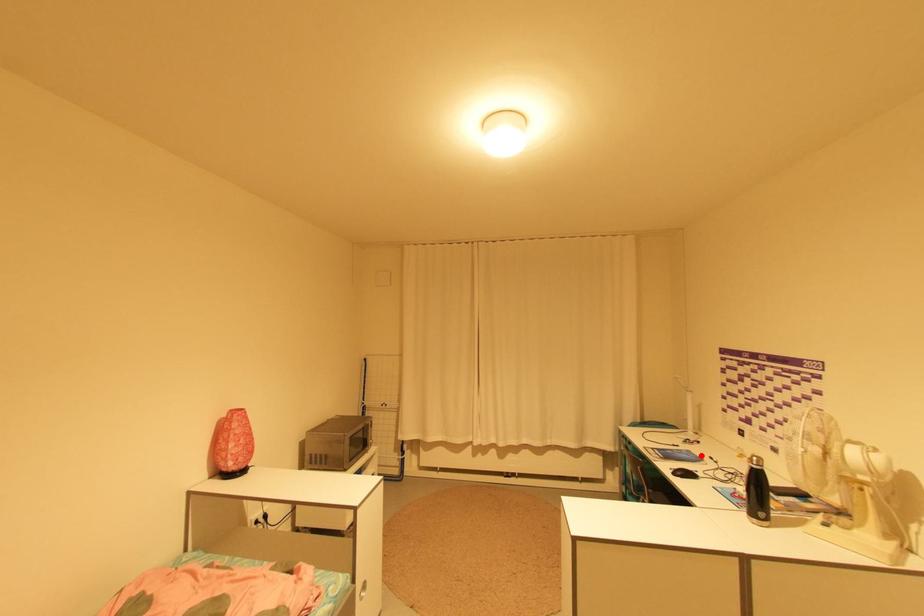
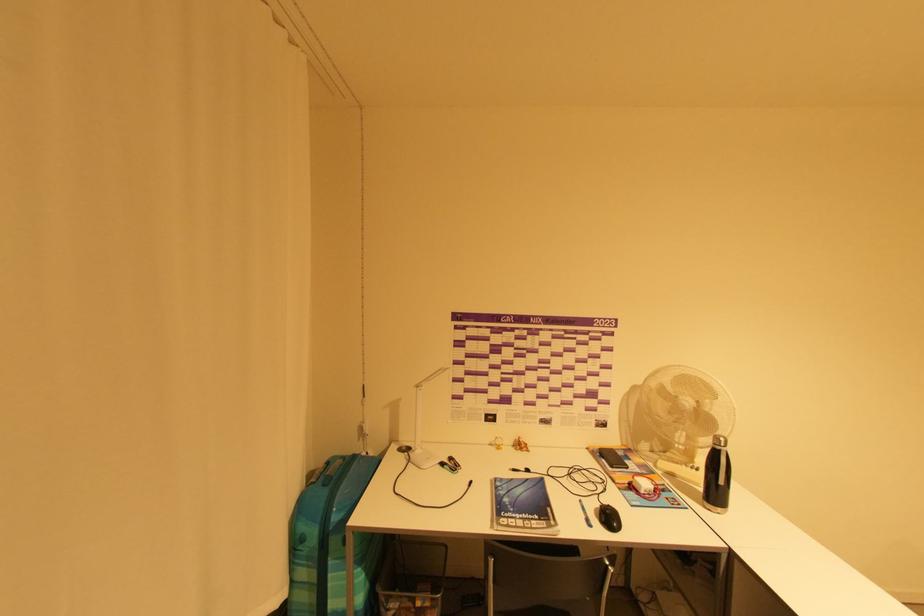
Locate, in the second image, the point that corresponds to the highlighted location in the first image.

(517, 480)